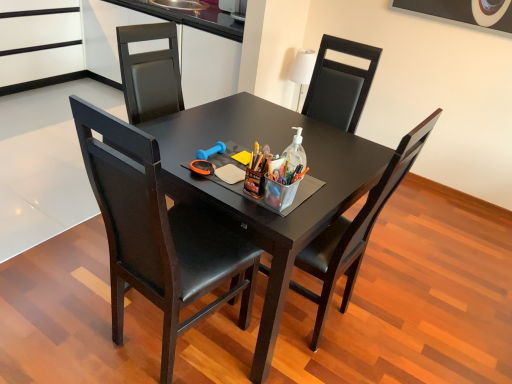
Question: Looking at their shapes, would you say translucent plastic bottle at center is wider or thinner than matte black chair at center, the 1th chair positioned from the left?

Choices:
 (A) thin
 (B) wide

Answer: (A)

Question: From a real-world perspective, relative to matte black chair at center, the 1th chair positioned from the left, is translucent plastic bottle at center vertically above or below?

Choices:
 (A) below
 (B) above

Answer: (B)

Question: Which of these objects is positioned farthest from the translucent plastic bottle at center?

Choices:
 (A) matte black chair at center, the 1th chair positioned from the left
 (B) black leather chair at center, acting as the first chair starting from the right
 (C) black glossy table at center

Answer: (A)

Question: Estimate the real-world distances between objects in this image. Which object is farther from the black glossy table at center?

Choices:
 (A) black leather chair at center, acting as the first chair starting from the right
 (B) matte black chair at center, which is counted as the second chair, starting from the right
 (C) translucent plastic bottle at center

Answer: (C)